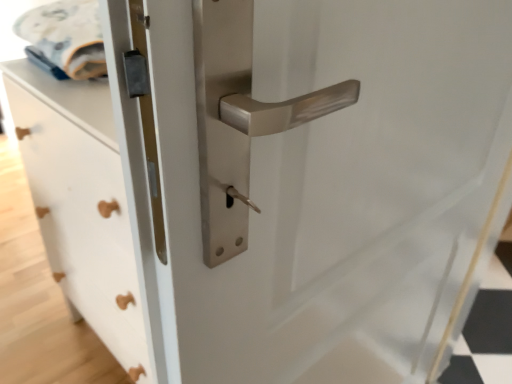
Measure the distance between white matte drawer at center-left and camera.

The depth of white matte drawer at center-left is 73.86 centimeters.

Where is `white matte drawer at center-left`? This screenshot has height=384, width=512. white matte drawer at center-left is located at coordinates (84, 224).

What do you see at coordinates (84, 224) in the screenshot?
I see `white matte drawer at center-left` at bounding box center [84, 224].

The width and height of the screenshot is (512, 384). I want to click on white matte drawer at center-left, so click(84, 224).